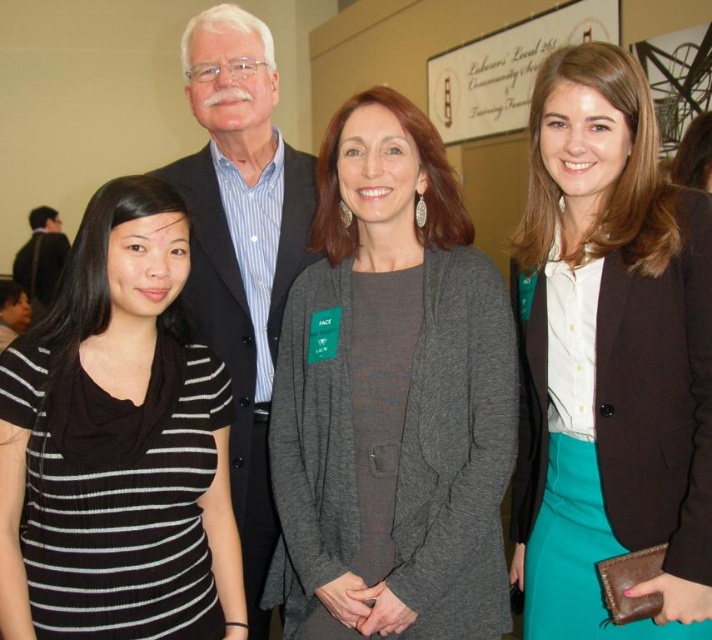
Is point (276, 596) in front of point (36, 218)?

That is True.

Does gray soft sweater at center have a lesser width compared to matte black suit at left?

Correct, gray soft sweater at center's width is less than matte black suit at left's.

Which is behind, point (417, 385) or point (41, 307)?

The point (41, 307) is behind.

At what (x,y) coordinates should I click in order to perform the action: click on gray soft sweater at center. Please return your answer as a coordinate pair (x, y). Looking at the image, I should click on pyautogui.click(x=392, y=397).

Can you confirm if teal satin skirt at center is positioned below wooden sign at upper center?

Correct, teal satin skirt at center is located below wooden sign at upper center.

Which is below, teal satin skirt at center or wooden sign at upper center?

teal satin skirt at center

Does point (555, 108) lie behind point (515, 112)?

No, (555, 108) is in front of (515, 112).

Image resolution: width=712 pixels, height=640 pixels. Find the location of `teal satin skirt at center`. teal satin skirt at center is located at coordinates (609, 358).

Is point (276, 193) farther from camera compared to point (493, 76)?

That is False.

The image size is (712, 640). I want to click on matte black suit at center, so click(241, 248).